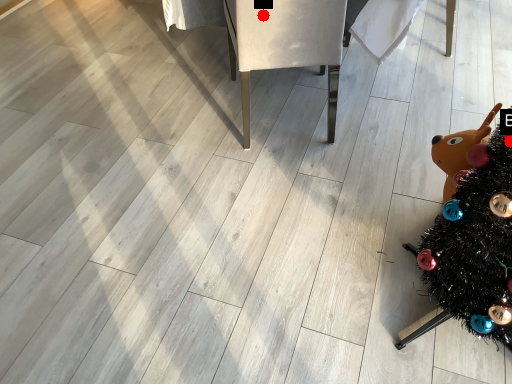
Question: Two points are circled on the image, labeled by A and B beside each circle. Which point is closer to the camera taking this photo?

Choices:
 (A) A is closer
 (B) B is closer

Answer: (B)